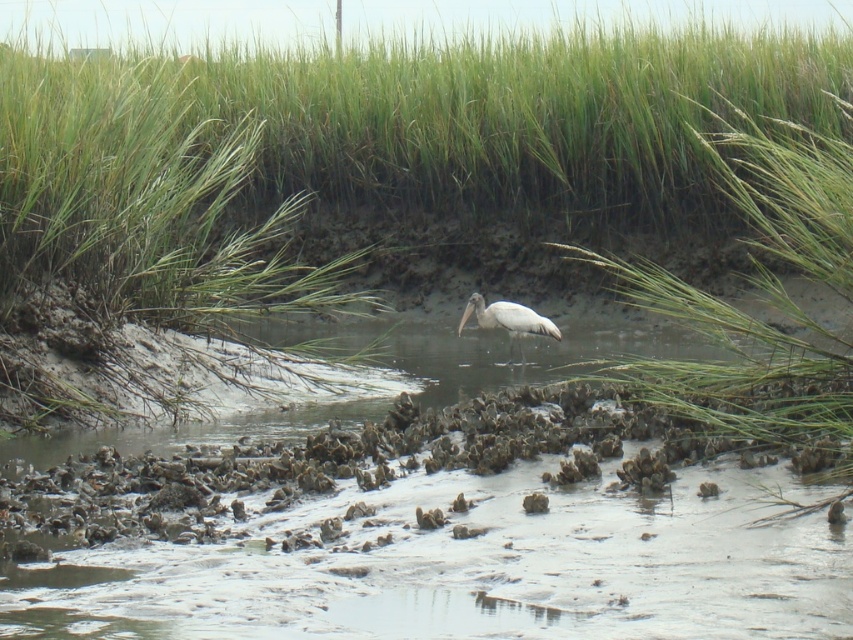
You are standing at the edge of the wetland and see the point marked at coordinates (367, 145). What is located at that point?

The point at coordinates (367, 145) marks green grass at center.